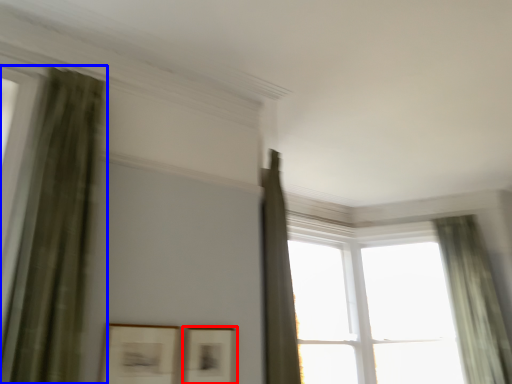
Question: Among these objects, which one is nearest to the camera, picture frame (highlighted by a red box) or curtain (highlighted by a blue box)?

Choices:
 (A) picture frame
 (B) curtain

Answer: (B)